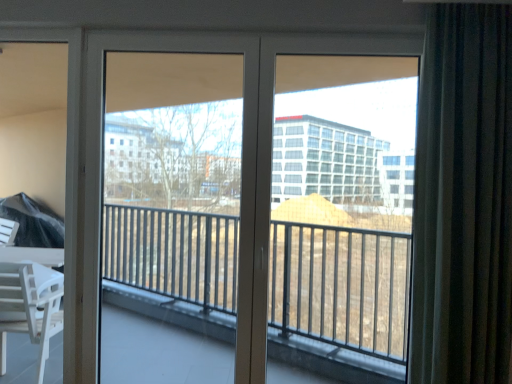
Question: From a real-world perspective, is white glossy door at center positioned above or below transparent glass window at center?

Choices:
 (A) above
 (B) below

Answer: (B)

Question: Considering the positions of white glossy door at center and transparent glass window at center in the image, is white glossy door at center bigger or smaller than transparent glass window at center?

Choices:
 (A) small
 (B) big

Answer: (B)

Question: Which of these objects is positioned farthest from the transparent glass window at center?

Choices:
 (A) dark gray textured curtain at right
 (B) white glossy door at center
 (C) clear glass screen door at center

Answer: (C)

Question: Which object is positioned farthest from the dark gray textured curtain at right?

Choices:
 (A) transparent glass window at center
 (B) clear glass screen door at center
 (C) white glossy door at center

Answer: (A)